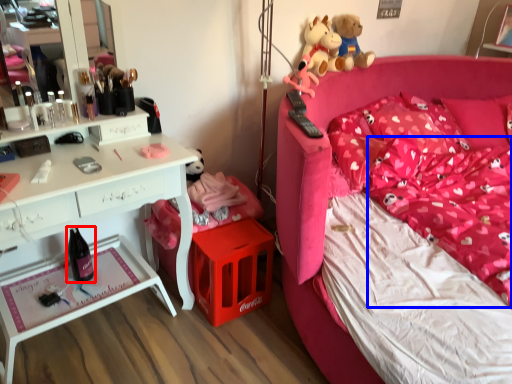
Question: Among these objects, which one is farthest to the camera, wine bottle (highlighted by a red box) or mattress (highlighted by a blue box)?

Choices:
 (A) wine bottle
 (B) mattress

Answer: (A)